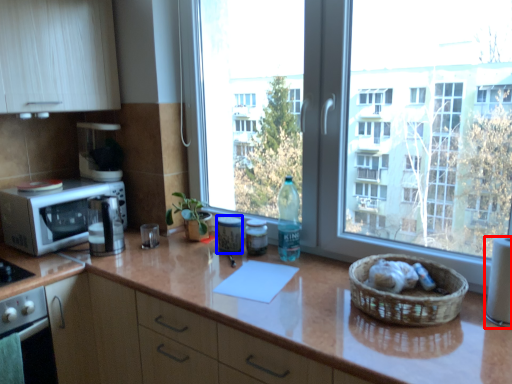
Question: Among these objects, which one is nearest to the camera, appliance (highlighted by a red box) or appliance (highlighted by a blue box)?

Choices:
 (A) appliance
 (B) appliance

Answer: (A)